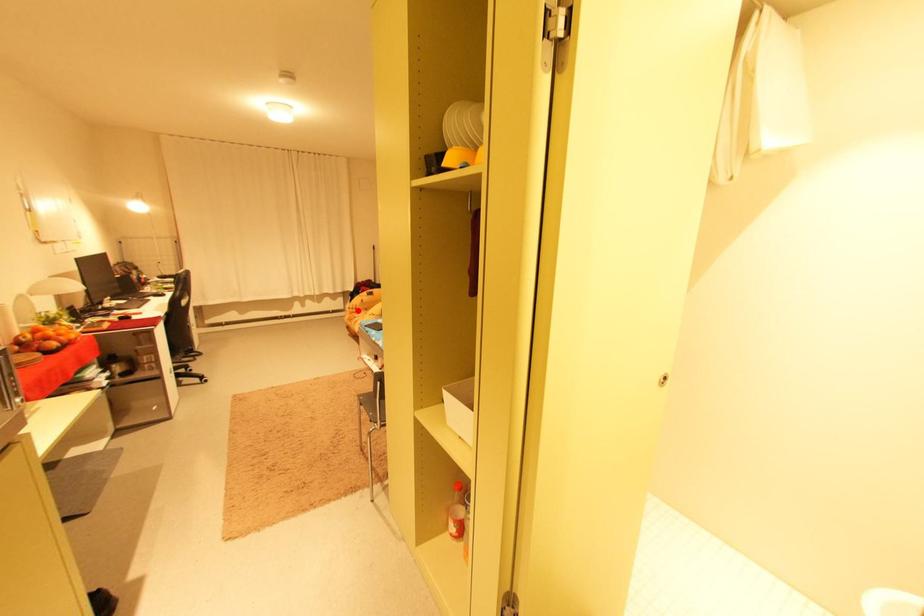
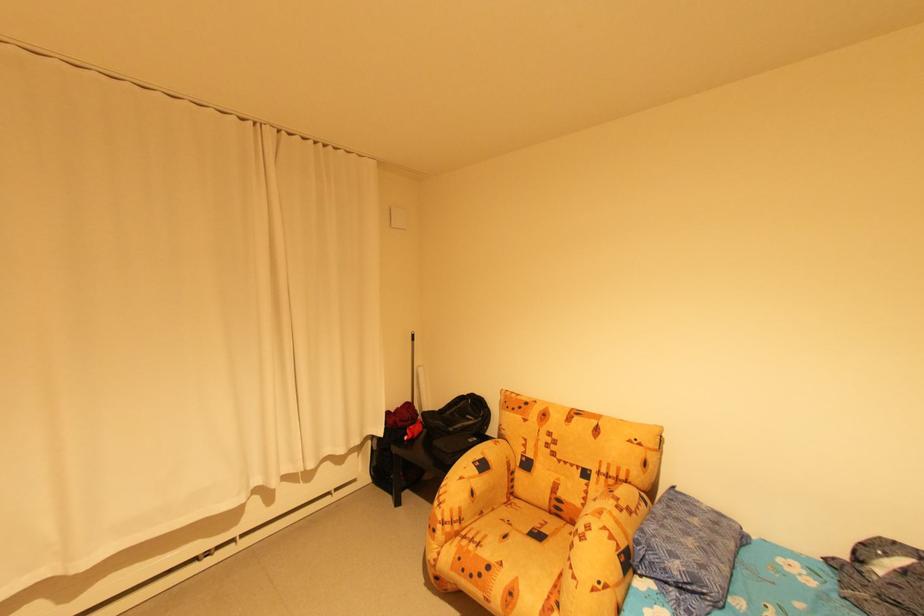
Locate, in the second image, the point that corresponds to the highlighted location in the first image.

(456, 529)